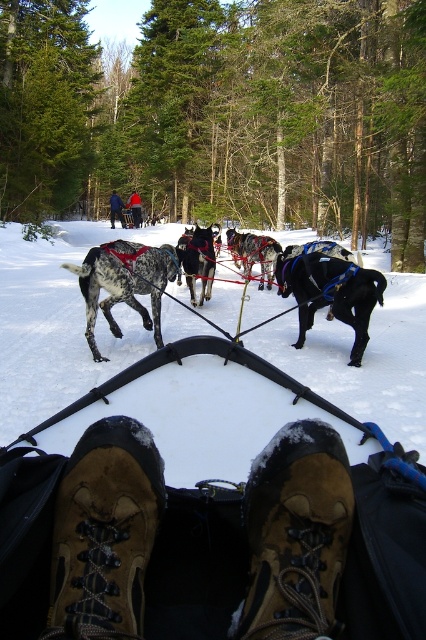
Looking at this image, you are a hiker who needs to retrieve your backpack. You see the white snow at center and the brushed metal backpack at upper center. Which object is located to the right of the other?

The white snow at center is positioned on the right side of brushed metal backpack at upper center.